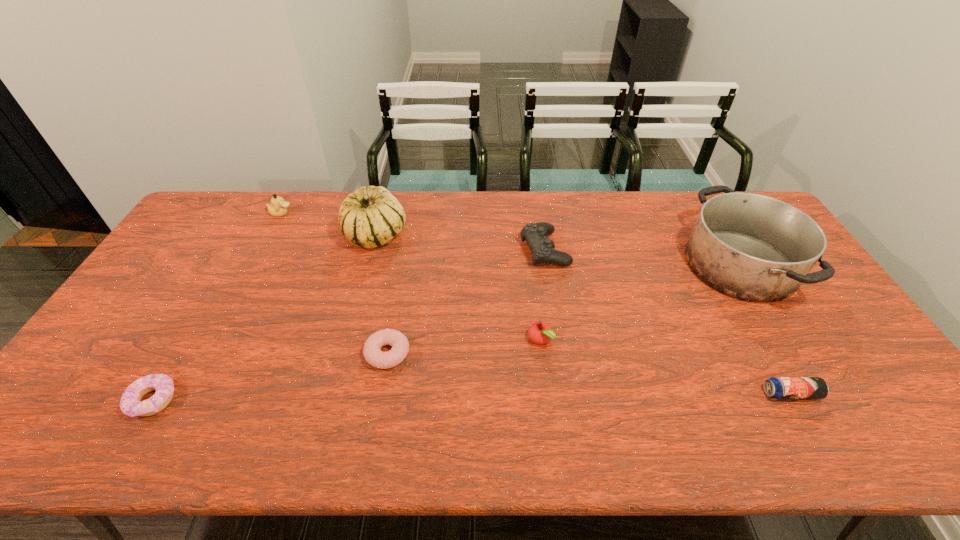
Locate an element on the screen. Image resolution: width=960 pixels, height=540 pixels. free space located 0.180m on the face of the duckling is located at coordinates (343, 213).

Find the location of a particular element. vacant region located on the back of the control is located at coordinates (537, 201).

Where is `free space located 0.330m on the right of the apple`? free space located 0.330m on the right of the apple is located at coordinates (676, 340).

You are a GUI agent. You are given a task and a screenshot of the screen. Output one action in this format:
    pyautogui.click(x=<x>, y=<y>)
    Task: Click on the vacant point located 0.150m on the right of the beer can
    
    Given the screenshot: What is the action you would take?
    pyautogui.click(x=879, y=394)

The height and width of the screenshot is (540, 960). Identify the location of vacant space located on the front of the farther doughnut. (380, 391).

Identify the location of vacant point located on the right of the left doughnut. The height and width of the screenshot is (540, 960). (281, 400).

This screenshot has width=960, height=540. Find the location of `gourd present at the far edge`. gourd present at the far edge is located at coordinates (369, 217).

I want to click on saucepan that is at the far edge, so click(x=751, y=247).

The image size is (960, 540). Identify the location of duckling that is at the far edge. (277, 208).

Image resolution: width=960 pixels, height=540 pixels. I want to click on control that is at the far edge, so click(536, 234).